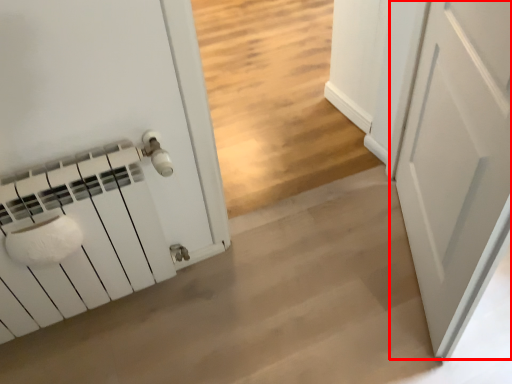
Question: From the image, what is the correct spatial relationship of door (annotated by the red box) in relation to concrete?

Choices:
 (A) left
 (B) right

Answer: (B)